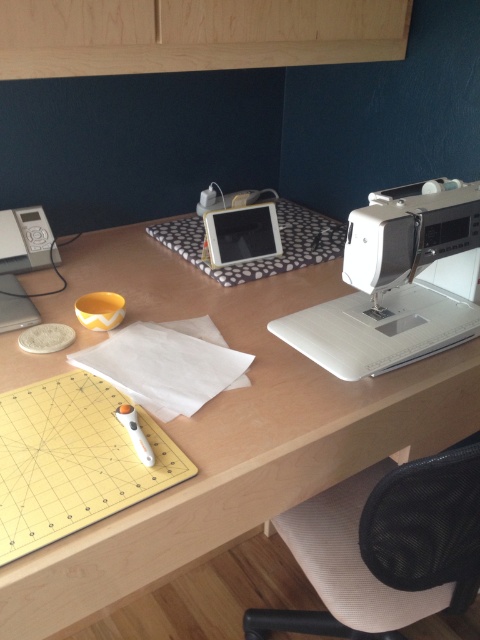
Question: Which point is closer to the camera?

Choices:
 (A) (420, 298)
 (B) (479, 372)

Answer: (B)

Question: Does wooden computer desk at center have a lesser width compared to white plastic sewing machine at right?

Choices:
 (A) no
 (B) yes

Answer: (A)

Question: Can you confirm if wooden computer desk at center is positioned above white plastic sewing machine at right?

Choices:
 (A) yes
 (B) no

Answer: (B)

Question: Which of the following is the closest to the observer?

Choices:
 (A) (410, 326)
 (B) (212, 305)

Answer: (A)

Question: Is wooden computer desk at center wider than white plastic sewing machine at right?

Choices:
 (A) no
 (B) yes

Answer: (B)